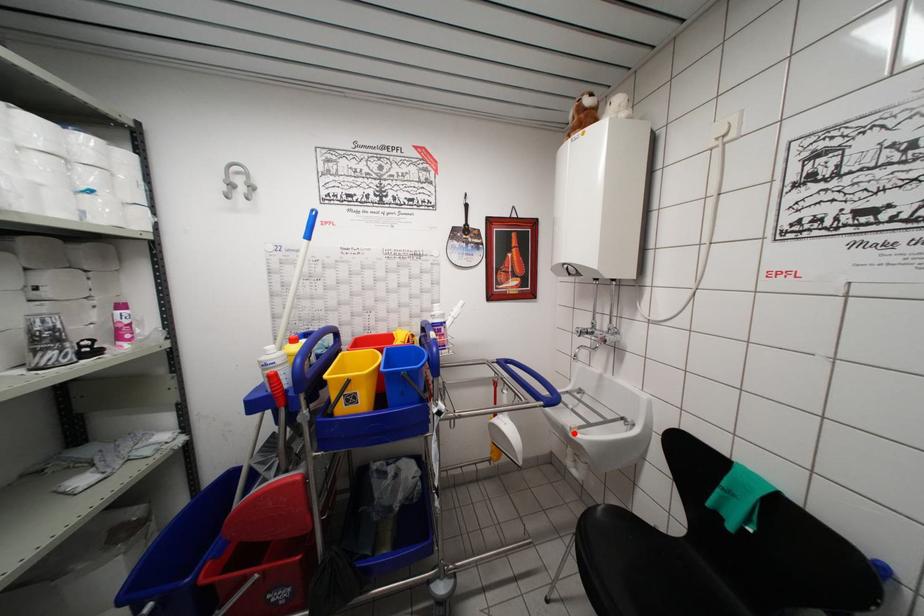
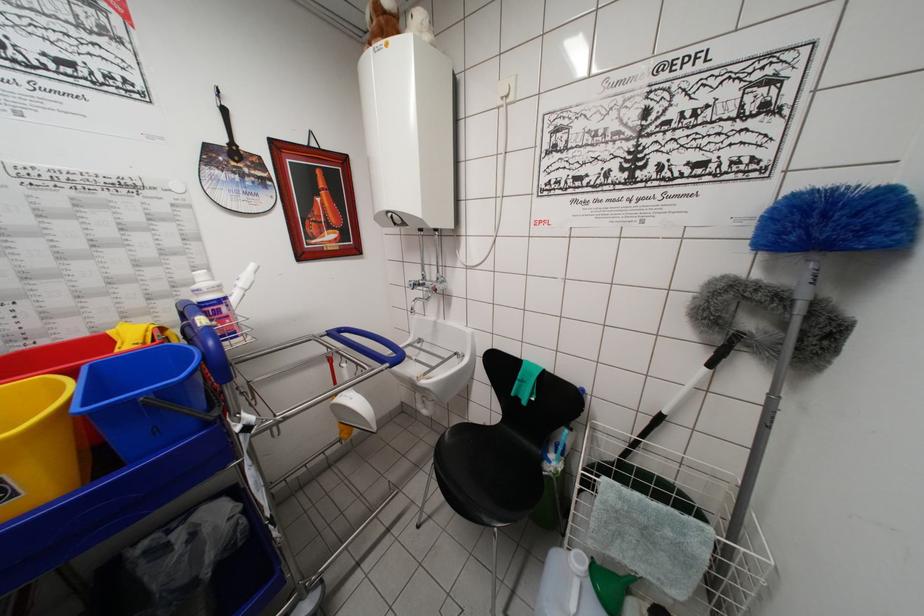
Locate, in the second image, the point that corresponds to the highlighted location in the first image.

(420, 383)